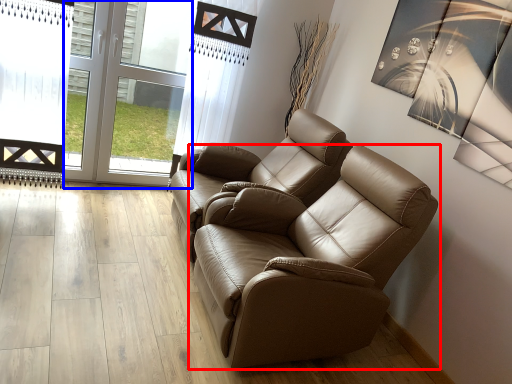
Question: Among these objects, which one is farthest to the camera, chair (highlighted by a red box) or glass door (highlighted by a blue box)?

Choices:
 (A) chair
 (B) glass door

Answer: (B)